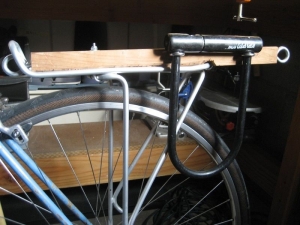
Locate an element on the screen. This screenshot has height=225, width=300. benchtop is located at coordinates (47, 144).